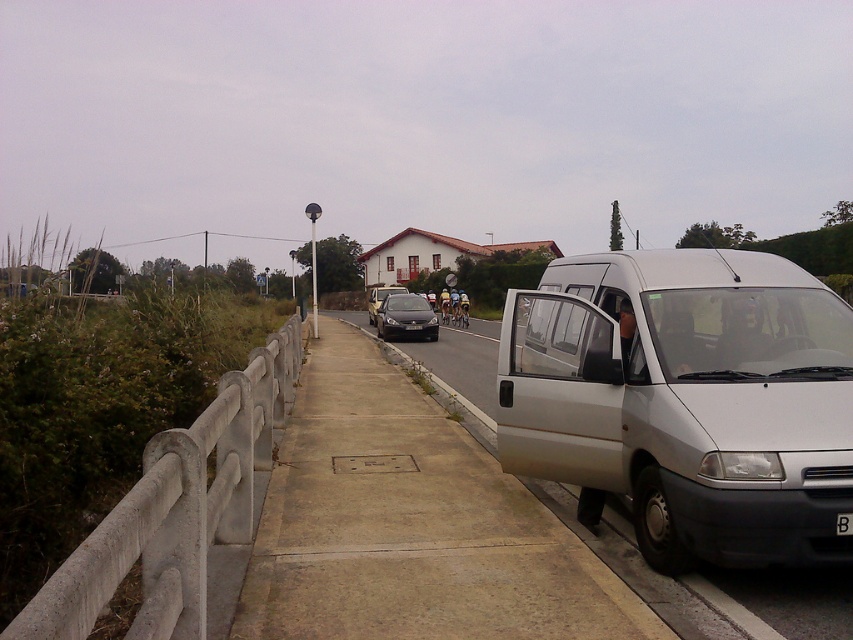
Is satin black sedan at center positioned in front of satin silver van at center?

That is True.

Can you confirm if satin black sedan at center is positioned to the left of satin silver van at center?

In fact, satin black sedan at center is to the right of satin silver van at center.

Who is more forward, (428, 316) or (375, 317)?

Point (428, 316) is more forward.

Identify the location of satin black sedan at center. This screenshot has height=640, width=853. (405, 317).

Can you confirm if concrete at left is positioned to the left of black plastic license plate at center?

Yes, concrete at left is to the left of black plastic license plate at center.

Is concrete at left shorter than black plastic license plate at center?

No.

Is point (202, 438) farther from viewer compared to point (844, 522)?

No, it is in front of (844, 522).

At what (x,y) coordinates should I click in order to perform the action: click on concrete at left. Please return your answer as a coordinate pair (x, y). This screenshot has width=853, height=640. Looking at the image, I should click on (177, 509).

Does concrete at left have a smaller size compared to satin silver van at center?

Correct, concrete at left occupies less space than satin silver van at center.

Which of these two, concrete at left or satin silver van at center, stands shorter?

concrete at left

Between point (148, 614) and point (373, 314), which one is positioned in front?

Positioned in front is point (148, 614).

The height and width of the screenshot is (640, 853). I want to click on concrete at left, so click(177, 509).